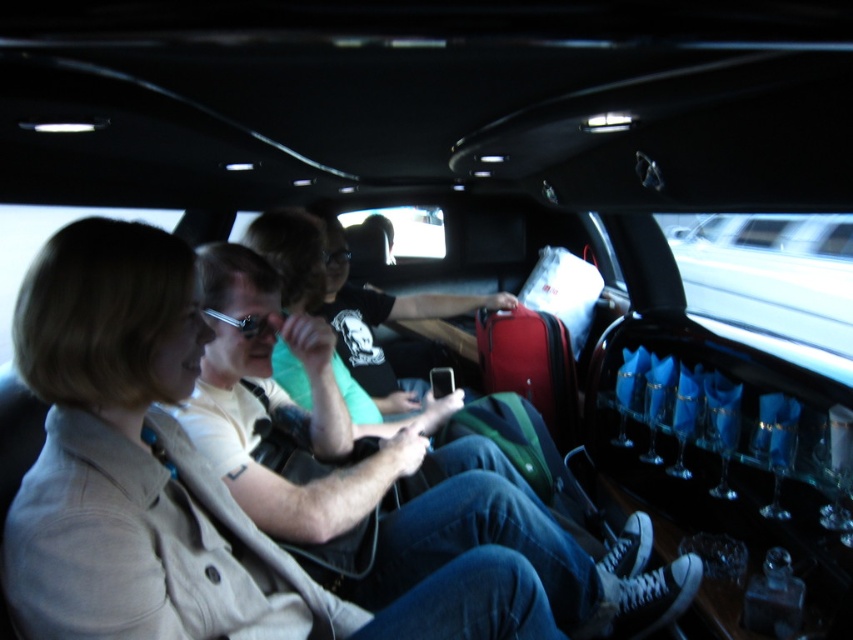
You are a passenger in the limousine and want to place your matte black phone at center on the seat next to your light beige jacket at center. Will the phone fit next to the jacket without overlapping?

The light beige jacket at center is smaller than the matte black phone at center, so the phone may not fit next to the jacket without overlapping because it is larger in size.

Looking at this image, you are inside a limousine and want to know which of the two points, point (45, 577) or point (340, 339), is closer to you. Based on the description, which point is nearer?

Point (45, 577) is closer to the viewer than point (340, 339).

You are a delivery robot with a 1 meter arm. You need to place a package on the light beige jacket at center. Your arm can reach 1.5 meters. Can you reach the matte black phone at center while placing the package?

The light beige jacket at center and matte black phone at center are 1.36 meters apart. Since your arm can reach 1.5 meters, you can reach the matte black phone at center while placing the package on the light beige jacket at center.